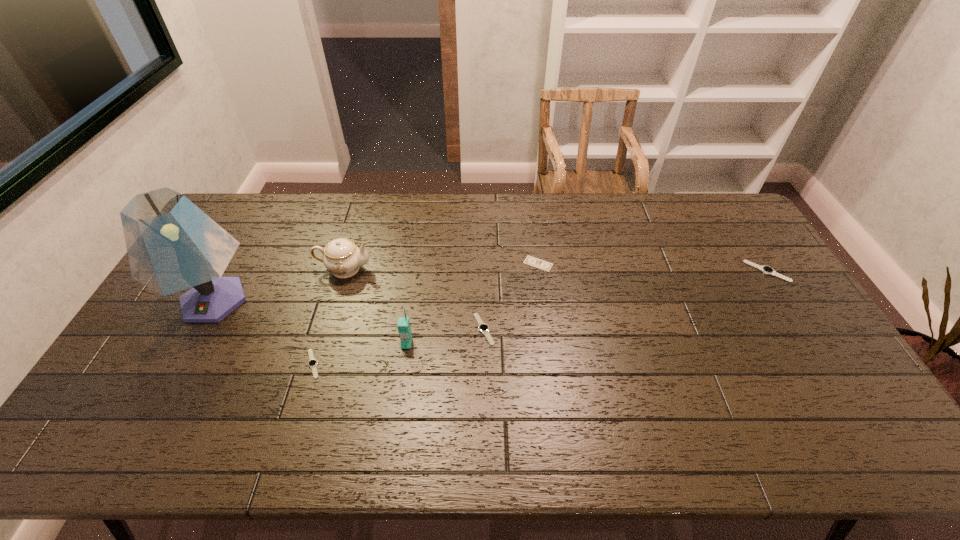
Where is `blank area in the image that satisfies the following two spatial constraints: 1. at the spout of the chinaware; 2. on the right side of the rightmost watch`? This screenshot has height=540, width=960. blank area in the image that satisfies the following two spatial constraints: 1. at the spout of the chinaware; 2. on the right side of the rightmost watch is located at coordinates (344, 272).